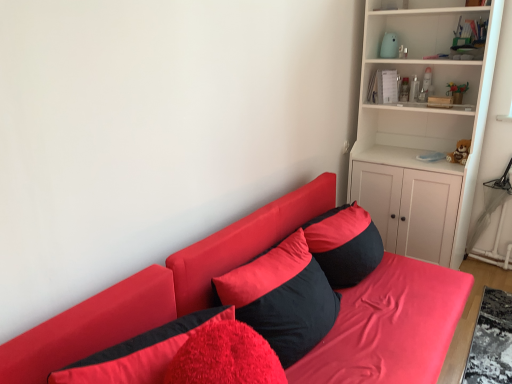
Identify the location of brown plush bear at upper right. (460, 152).

Image resolution: width=512 pixels, height=384 pixels. I want to click on black matte pillow at center, which is the 3th pillow from front to back, so click(x=344, y=244).

The image size is (512, 384). What do you see at coordinates (282, 298) in the screenshot?
I see `velvet black pillow at center, which ranks as the 2th pillow in back-to-front order` at bounding box center [282, 298].

You are a GUI agent. You are given a task and a screenshot of the screen. Output one action in this format:
    pyautogui.click(x=<x>, y=<y>)
    Task: Click on the brown plush bear at upper right
    This screenshot has width=512, height=384.
    Given the screenshot: What is the action you would take?
    pyautogui.click(x=460, y=152)

Does velvet black pillow at center, which is the 2th pillow from front to back, have a lesser width compared to brown plush bear at upper right?

Incorrect, the width of velvet black pillow at center, which is the 2th pillow from front to back, is not less than that of brown plush bear at upper right.

How much distance is there between velvet black pillow at center, which is the 2th pillow from front to back, and brown plush bear at upper right?

velvet black pillow at center, which is the 2th pillow from front to back, and brown plush bear at upper right are 4.83 feet apart.

Looking at this image, what's the angular difference between velvet black pillow at center, which is the 2th pillow from front to back, and brown plush bear at upper right's facing directions?

They differ by 91.2 degrees in their facing directions.

The height and width of the screenshot is (384, 512). Find the location of `toy above the velvet black pillow at center, which ranks as the 2th pillow in back-to-front order (from the image's perspective)`. toy above the velvet black pillow at center, which ranks as the 2th pillow in back-to-front order (from the image's perspective) is located at coordinates (460, 152).

Between matte red couch at center and black matte pillow at center, which is the 3th pillow from front to back, which one has larger width?

matte red couch at center is wider.

From a real-world perspective, is matte red couch at center above or below black matte pillow at center, acting as the 1th pillow starting from the back?

matte red couch at center is below black matte pillow at center, acting as the 1th pillow starting from the back.

Could you tell me if matte red couch at center is facing black matte pillow at center, acting as the 1th pillow starting from the back?

No, matte red couch at center is not facing towards black matte pillow at center, acting as the 1th pillow starting from the back.

Is white matte cabinet at upper right in contact with matte red couch at center?

white matte cabinet at upper right and matte red couch at center are clearly separated.

Is white matte cabinet at upper right to the left of matte red couch at center from the viewer's perspective?

Incorrect, white matte cabinet at upper right is not on the left side of matte red couch at center.

Based on the photo, from a real-world perspective, is white matte cabinet at upper right positioned under matte red couch at center based on gravity?

Incorrect, from a real-world perspective, white matte cabinet at upper right is higher than matte red couch at center.

Considering the relative sizes of white matte cabinet at upper right and matte red couch at center in the image provided, is white matte cabinet at upper right shorter than matte red couch at center?

In fact, white matte cabinet at upper right may be taller than matte red couch at center.

From a real-world perspective, starting from the white matte cabinet at upper right, which pillow is the 3rd one below it? Please provide its 2D coordinates.

[(344, 244)]

Is black matte pillow at center, which is the 3th pillow from front to back, taller than white matte cabinet at upper right?

In fact, black matte pillow at center, which is the 3th pillow from front to back, may be shorter than white matte cabinet at upper right.

Could you tell me if black matte pillow at center, acting as the 1th pillow starting from the back, is turned towards white matte cabinet at upper right?

No, black matte pillow at center, acting as the 1th pillow starting from the back, is not facing towards white matte cabinet at upper right.

Is the position of black matte pillow at center, which is the 3th pillow from front to back, more distant than that of white matte cabinet at upper right?

No, black matte pillow at center, which is the 3th pillow from front to back, is in front of white matte cabinet at upper right.

Is velvet black pillow at center, which is the 2th pillow from front to back, in front of matte red couch at center?

That is False.

Is velvet black pillow at center, which is the 2th pillow from front to back, wider than matte red couch at center?

In fact, velvet black pillow at center, which is the 2th pillow from front to back, might be narrower than matte red couch at center.

Is matte red couch at center at the back of velvet black pillow at center, which ranks as the 2th pillow in back-to-front order?

Yes, matte red couch at center is at the back of velvet black pillow at center, which ranks as the 2th pillow in back-to-front order.

How far apart are velvet black pillow at center, which is the 2th pillow from front to back, and matte red couch at center?

velvet black pillow at center, which is the 2th pillow from front to back, is 9.91 inches away from matte red couch at center.

Can you confirm if velvet red pillow at lower left, which is counted as the 1th pillow, starting from the front, is wider than black matte pillow at center, acting as the 1th pillow starting from the back?

In fact, velvet red pillow at lower left, which is counted as the 1th pillow, starting from the front, might be narrower than black matte pillow at center, acting as the 1th pillow starting from the back.

From the image's perspective, between velvet red pillow at lower left, which is counted as the 1th pillow, starting from the front, and black matte pillow at center, which is the 3th pillow from front to back, which one is located above?

black matte pillow at center, which is the 3th pillow from front to back, appears higher in the image.

Is velvet red pillow at lower left, acting as the 3th pillow starting from the back, far from black matte pillow at center, which is the 3th pillow from front to back?

No, velvet red pillow at lower left, acting as the 3th pillow starting from the back, is not far from black matte pillow at center, which is the 3th pillow from front to back.

Is velvet red pillow at lower left, which is counted as the 1th pillow, starting from the front, taller than black matte pillow at center, which is the 3th pillow from front to back?

Yes, velvet red pillow at lower left, which is counted as the 1th pillow, starting from the front, is taller than black matte pillow at center, which is the 3th pillow from front to back.

How different are the orientations of matte red couch at center and velvet red pillow at lower left, which is counted as the 1th pillow, starting from the front, in degrees?

0.000851 degrees separate the facing orientations of matte red couch at center and velvet red pillow at lower left, which is counted as the 1th pillow, starting from the front.

Which pillow is the 1st one when counting from the back of the matte red couch at center? Please provide its 2D coordinates.

[(140, 353)]

How distant is matte red couch at center from velvet red pillow at lower left, acting as the 3th pillow starting from the back?

matte red couch at center is 26.07 inches away from velvet red pillow at lower left, acting as the 3th pillow starting from the back.

Between point (437, 280) and point (170, 331), which one is positioned in front?

The point (170, 331) is in front.

Where is `toy above the velvet black pillow at center, which ranks as the 2th pillow in back-to-front order (from a real-world perspective)`? toy above the velvet black pillow at center, which ranks as the 2th pillow in back-to-front order (from a real-world perspective) is located at coordinates (460, 152).

The width and height of the screenshot is (512, 384). I want to click on studio couch lying on the left of black matte pillow at center, which is the 3th pillow from front to back, so click(159, 289).

Based on their spatial positions, is velvet red pillow at lower left, which is counted as the 1th pillow, starting from the front, or velvet black pillow at center, which is the 2th pillow from front to back, further from white matte cabinet at upper right?

velvet red pillow at lower left, which is counted as the 1th pillow, starting from the front.

From the image, which object appears to be nearer to black matte pillow at center, acting as the 1th pillow starting from the back, velvet red pillow at lower left, acting as the 3th pillow starting from the back, or velvet black pillow at center, which is the 2th pillow from front to back?

Based on the image, velvet black pillow at center, which is the 2th pillow from front to back, appears to be nearer to black matte pillow at center, acting as the 1th pillow starting from the back.

Based on their spatial positions, is velvet red pillow at lower left, which is counted as the 1th pillow, starting from the front, or matte red couch at center further from velvet black pillow at center, which is the 2th pillow from front to back?

velvet red pillow at lower left, which is counted as the 1th pillow, starting from the front, is positioned further to the anchor velvet black pillow at center, which is the 2th pillow from front to back.

Which object lies further to the anchor point velvet red pillow at lower left, which is counted as the 1th pillow, starting from the front, matte red couch at center or white matte cabinet at upper right?

The object further to velvet red pillow at lower left, which is counted as the 1th pillow, starting from the front, is white matte cabinet at upper right.

From the image, which object appears to be nearer to white matte cabinet at upper right, velvet black pillow at center, which is the 2th pillow from front to back, or brown plush bear at upper right?

Among the two, brown plush bear at upper right is located nearer to white matte cabinet at upper right.

Considering their positions, is velvet red pillow at lower left, acting as the 3th pillow starting from the back, positioned closer to white matte cabinet at upper right than brown plush bear at upper right?

brown plush bear at upper right is closer to white matte cabinet at upper right.

Based on their spatial positions, is brown plush bear at upper right or black matte pillow at center, which is the 3th pillow from front to back, closer to velvet black pillow at center, which ranks as the 2th pillow in back-to-front order?

black matte pillow at center, which is the 3th pillow from front to back.

When comparing their distances from brown plush bear at upper right, does black matte pillow at center, which is the 3th pillow from front to back, or velvet black pillow at center, which is the 2th pillow from front to back, seem closer?

Among the two, black matte pillow at center, which is the 3th pillow from front to back, is located nearer to brown plush bear at upper right.

The width and height of the screenshot is (512, 384). Find the location of `pillow between velvet black pillow at center, which is the 2th pillow from front to back, and brown plush bear at upper right, along the z-axis`. pillow between velvet black pillow at center, which is the 2th pillow from front to back, and brown plush bear at upper right, along the z-axis is located at coordinates (344, 244).

This screenshot has height=384, width=512. Find the location of `shelf between velvet red pillow at lower left, acting as the 3th pillow starting from the back, and brown plush bear at upper right, along the z-axis`. shelf between velvet red pillow at lower left, acting as the 3th pillow starting from the back, and brown plush bear at upper right, along the z-axis is located at coordinates (423, 122).

Locate an element on the screen. pillow located between matte red couch at center and velvet black pillow at center, which ranks as the 2th pillow in back-to-front order, in the depth direction is located at coordinates (140, 353).

Image resolution: width=512 pixels, height=384 pixels. I want to click on pillow between velvet black pillow at center, which is the 2th pillow from front to back, and white matte cabinet at upper right, in the horizontal direction, so click(344, 244).